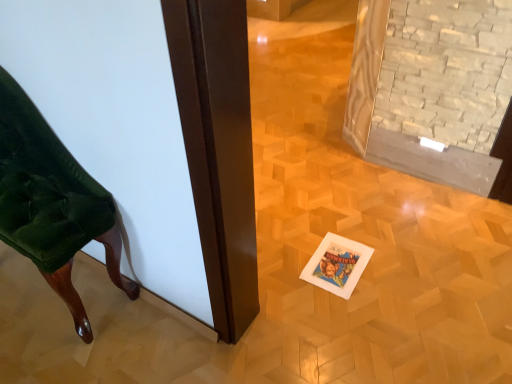
Find the location of `vacant space behind white paper postcard at center`. vacant space behind white paper postcard at center is located at coordinates (327, 227).